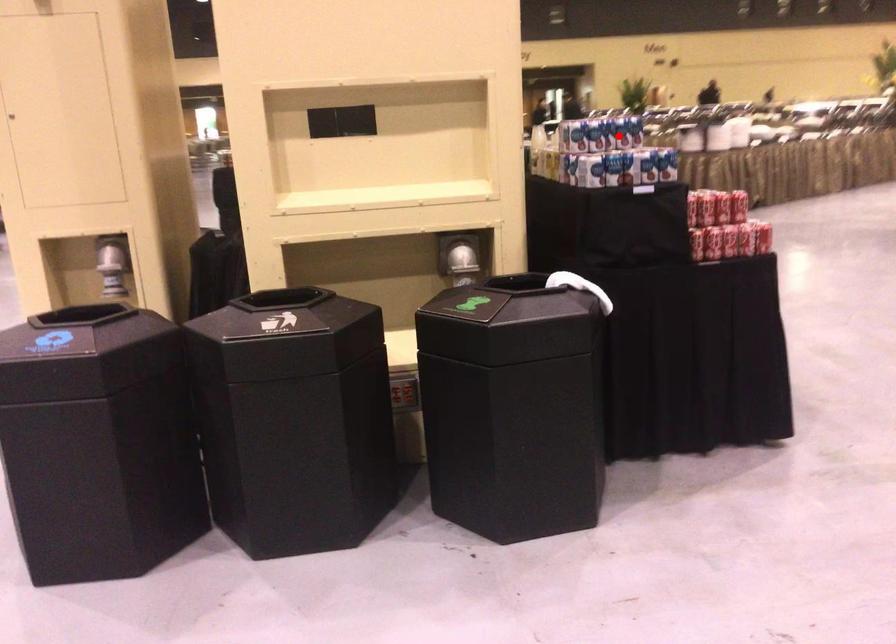
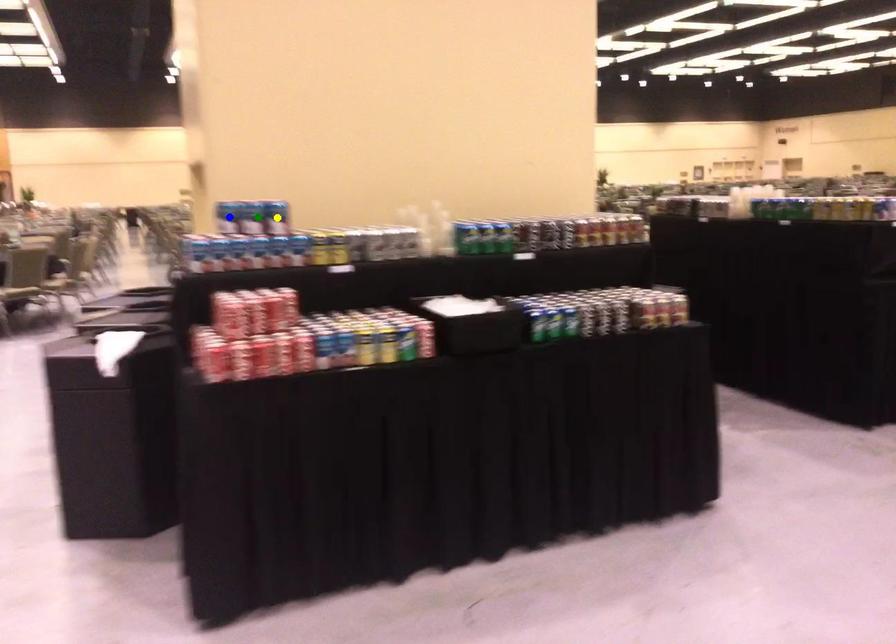
Question: I am providing you with two images of the same scene from different viewpoints. A red point is marked on the first image. You are given multiple points on the second image. In image 2, which mark is for the same physical point as the one in image 1?

Choices:
 (A) green point
 (B) blue point
 (C) yellow point

Answer: (B)